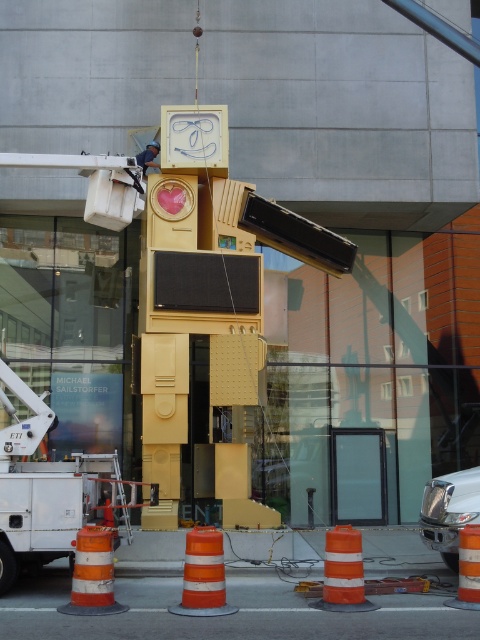
You are standing at the origin point of the coordinate system in the image and want to move towards the white metallic utility truck at lower left. What are the coordinates you need to move to reach it?

The coordinates to reach the white metallic utility truck at lower left are at point (41,488).

You are a delivery person who needs to park your 2.5 meters tall delivery van next to the white metallic utility truck at lower left and the blue denim overalls at upper center. Which object should you avoid parking near to ensure enough clearance?

You should avoid parking near the white metallic utility truck at lower left because it is much taller than the blue denim overalls at upper center, which means there might not be enough clearance for your tall van.